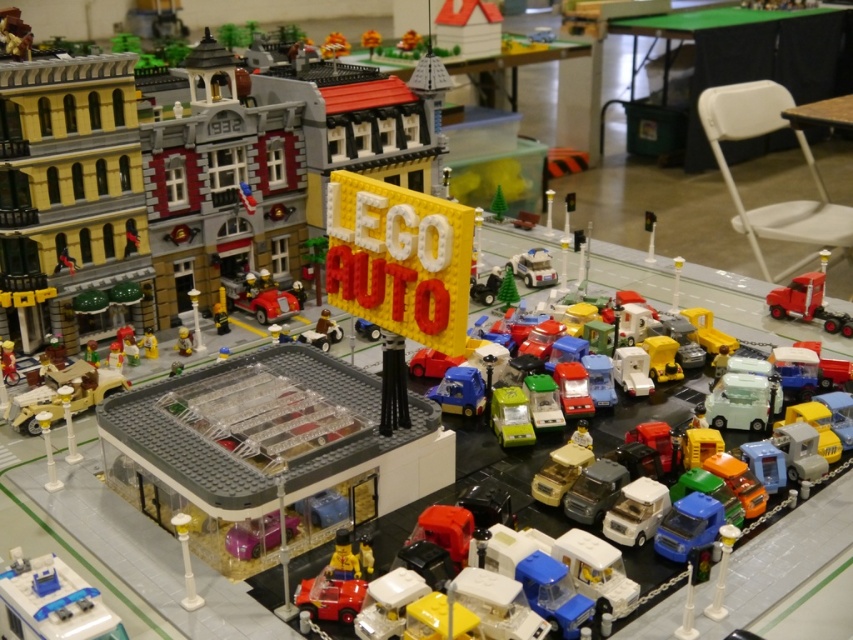
Which is above, green fabric table at upper right or matte yellow minifigure at center?

green fabric table at upper right

Does point (709, 65) lie behind point (149, 346)?

Yes.

I want to click on green fabric table at upper right, so click(x=753, y=56).

Consider the image. Is blue plastic police car at lower left below translucent plastic building at center-left?

Yes.

Can you confirm if blue plastic police car at lower left is wider than translucent plastic building at center-left?

Indeed, blue plastic police car at lower left has a greater width compared to translucent plastic building at center-left.

Is point (96, 596) farther from viewer compared to point (180, 330)?

That is False.

This screenshot has height=640, width=853. Identify the location of blue plastic police car at lower left. (51, 604).

Can you confirm if wooden table at upper right is smaller than translucent plastic building at center-left?

No, wooden table at upper right is not smaller than translucent plastic building at center-left.

Can you confirm if wooden table at upper right is positioned to the left of translucent plastic building at center-left?

No, wooden table at upper right is not to the left of translucent plastic building at center-left.

Between point (836, 106) and point (186, 349), which one is positioned behind?

The point (836, 106) is behind.

Locate an element on the screen. The height and width of the screenshot is (640, 853). wooden table at upper right is located at coordinates (821, 113).